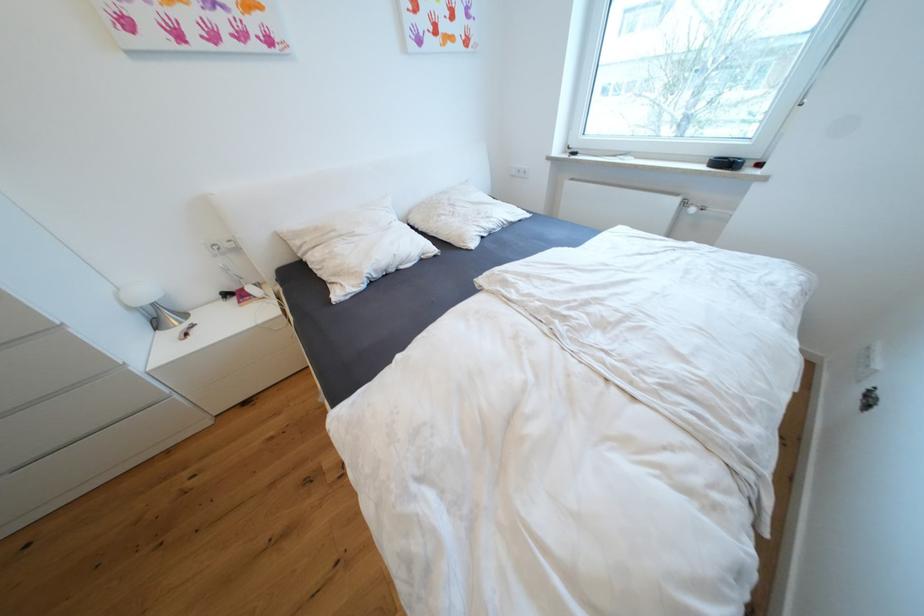
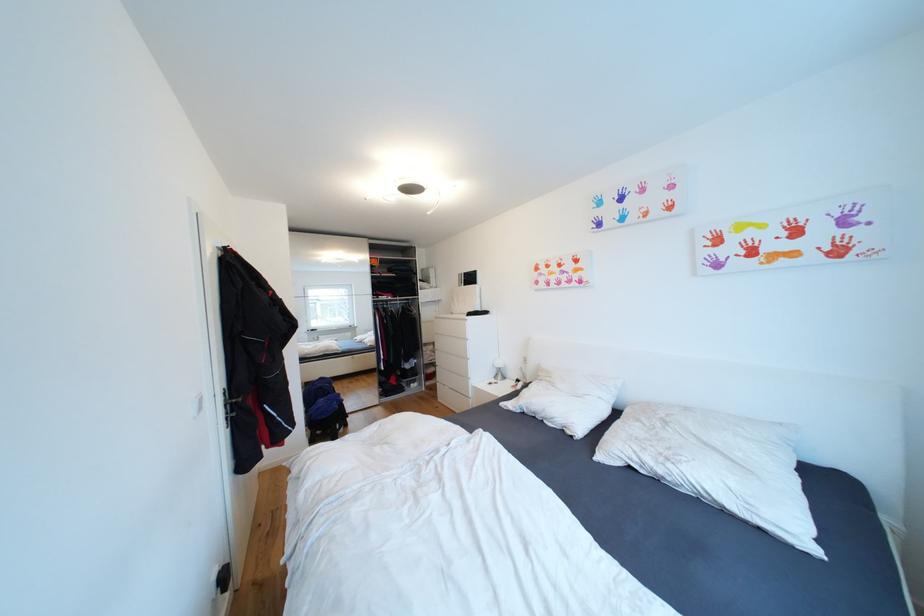
Where in the second image is the point corresponding to (x=165, y=326) from the first image?

(503, 378)